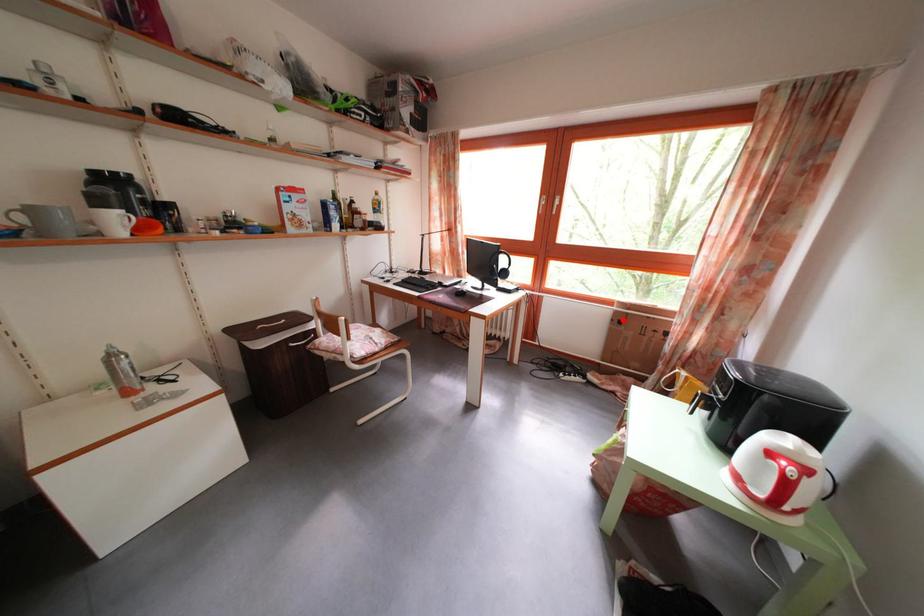
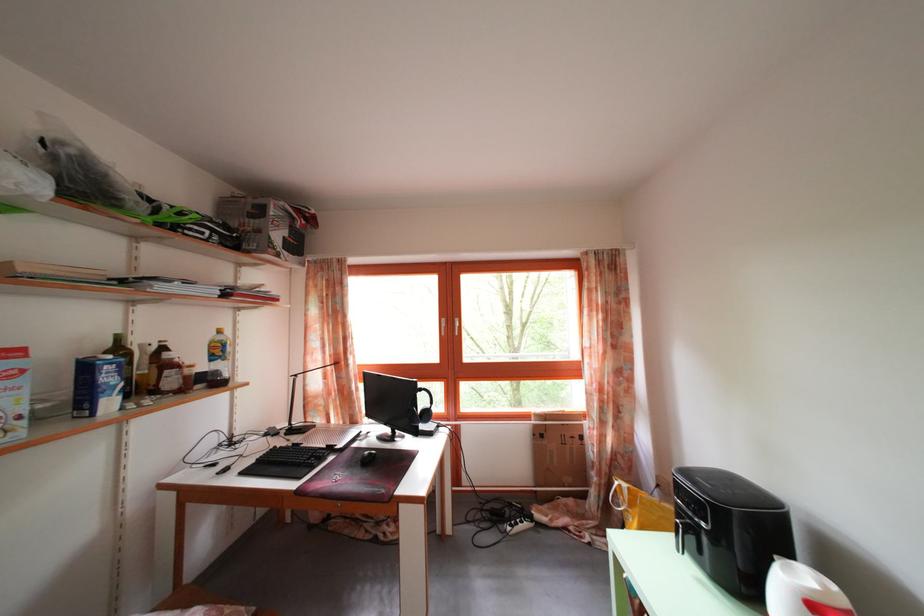
In the second image, find the point that corresponds to the highlighted location in the first image.

(542, 432)